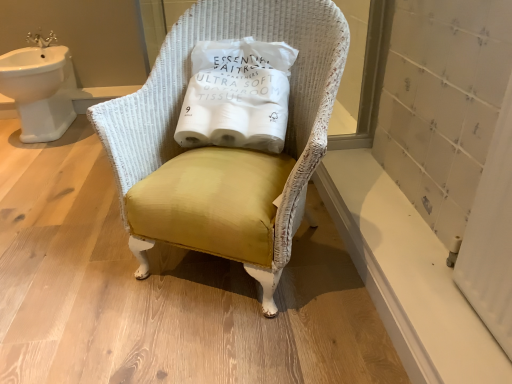
Identify the location of free space in front of mustard velvet chair at center. (221, 339).